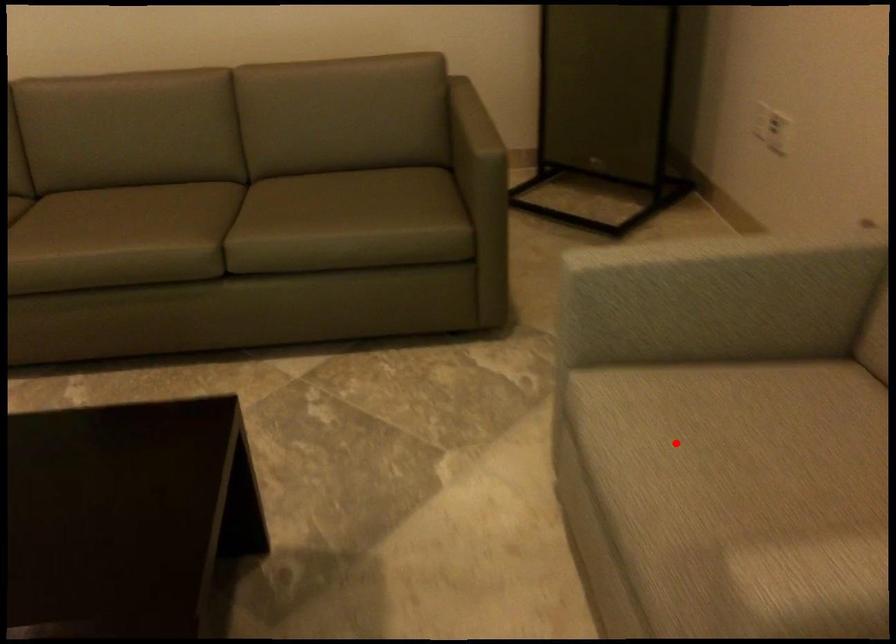
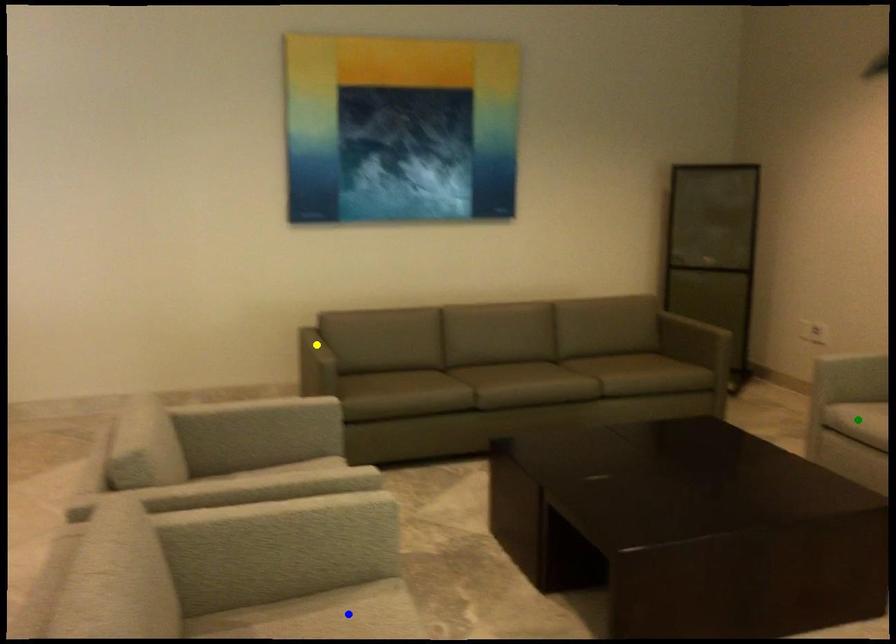
Question: I am providing you with two images of the same scene from different viewpoints. A red point is marked on the first image. You are given multiple points on the second image. Which point in image 2 is actually the same real-world point as the red point in image 1?

Choices:
 (A) yellow point
 (B) green point
 (C) blue point

Answer: (B)